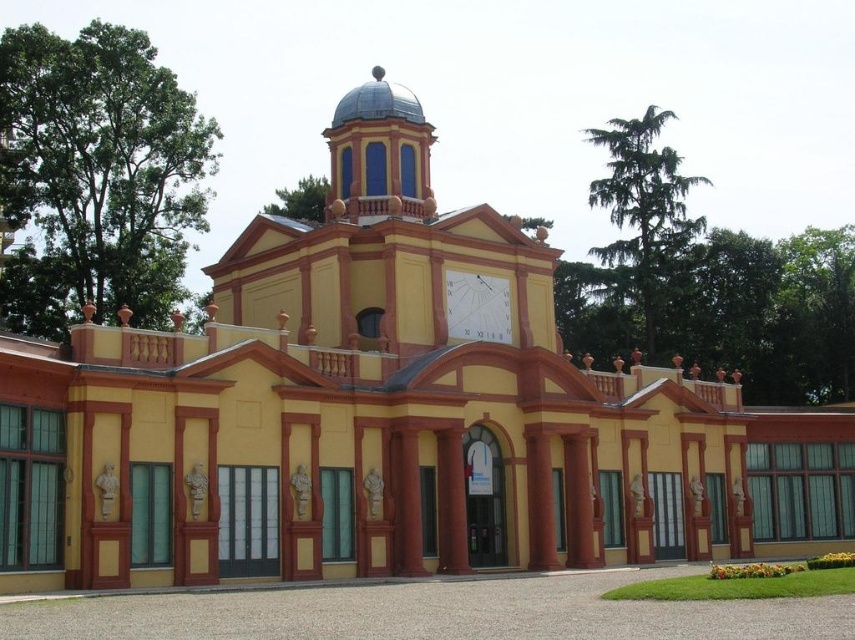
Is point (381, 205) farther from viewer compared to point (479, 336)?

Yes, point (381, 205) is farther from viewer.

Is blue glass dome at center below white glossy clock at center?

No, blue glass dome at center is not below white glossy clock at center.

The height and width of the screenshot is (640, 855). I want to click on blue glass dome at center, so click(379, 148).

At what (x,y) coordinates should I click in order to perform the action: click on blue glass dome at center. Please return your answer as a coordinate pair (x, y). Looking at the image, I should click on (379, 148).